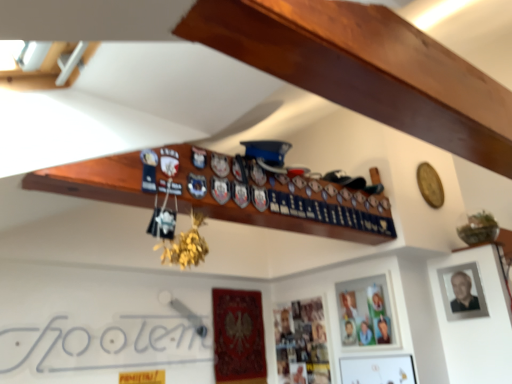
Question: Would you say white paper at lower left is a long distance from matte wooden picture frame at center, which is the second picture frame from left to right?

Choices:
 (A) yes
 (B) no

Answer: (A)

Question: Are white paper at lower left and matte wooden picture frame at center, the 2th picture frame in the right-to-left sequence, beside each other?

Choices:
 (A) no
 (B) yes

Answer: (A)

Question: Does white paper at lower left turn towards matte wooden picture frame at center, the 2th picture frame in the right-to-left sequence?

Choices:
 (A) yes
 (B) no

Answer: (B)

Question: Does white paper at lower left have a lesser height compared to matte wooden picture frame at center, which is the second picture frame from left to right?

Choices:
 (A) yes
 (B) no

Answer: (A)

Question: From the image's perspective, is white paper at lower left over matte wooden picture frame at center, the 2th picture frame in the right-to-left sequence?

Choices:
 (A) no
 (B) yes

Answer: (A)

Question: Would you say matte wooden picture frame at center, which is the second picture frame from left to right, is inside or outside matte black photo frame at upper right, acting as the 3th picture frame starting from the left?

Choices:
 (A) inside
 (B) outside

Answer: (B)

Question: Is point (339, 326) closer or farther from the camera than point (470, 286)?

Choices:
 (A) closer
 (B) farther

Answer: (B)

Question: In terms of height, does matte wooden picture frame at center, the 2th picture frame in the right-to-left sequence, look taller or shorter compared to matte black photo frame at upper right, acting as the 3th picture frame starting from the left?

Choices:
 (A) tall
 (B) short

Answer: (A)

Question: Relative to matte black photo frame at upper right, acting as the 3th picture frame starting from the left, is matte wooden picture frame at center, which is the second picture frame from left to right, in front or behind?

Choices:
 (A) behind
 (B) front

Answer: (A)

Question: From a real-world perspective, is metallic silver photo frame at lower center, positioned as the first picture frame in left-to-right order, above or below white paper at lower left?

Choices:
 (A) above
 (B) below

Answer: (B)

Question: Visually, is metallic silver photo frame at lower center, positioned as the first picture frame in left-to-right order, positioned to the left or to the right of white paper at lower left?

Choices:
 (A) right
 (B) left

Answer: (A)

Question: In terms of size, does metallic silver photo frame at lower center, which ranks as the third picture frame in right-to-left order, appear bigger or smaller than white paper at lower left?

Choices:
 (A) big
 (B) small

Answer: (B)

Question: Does point (323, 369) appear closer or farther from the camera than point (194, 337)?

Choices:
 (A) farther
 (B) closer

Answer: (B)

Question: Is white paper at lower left in front of or behind matte wooden picture frame at center, the 2th picture frame in the right-to-left sequence, in the image?

Choices:
 (A) front
 (B) behind

Answer: (A)

Question: Is white paper at lower left bigger or smaller than matte wooden picture frame at center, the 2th picture frame in the right-to-left sequence?

Choices:
 (A) big
 (B) small

Answer: (A)